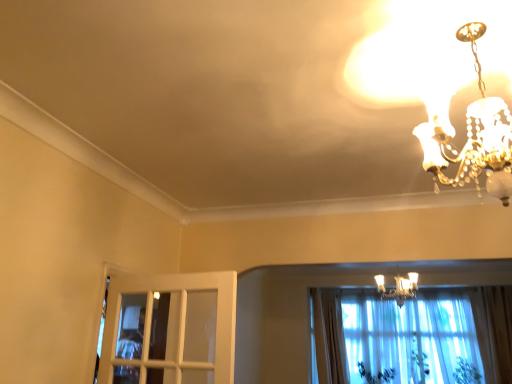
Question: Considering the positions of light beige fabric curtain at lower center and green leafy plant at lower right, arranged as the 3th plant when viewed from the left, in the image, is light beige fabric curtain at lower center wider or thinner than green leafy plant at lower right, arranged as the 3th plant when viewed from the left,?

Choices:
 (A) wide
 (B) thin

Answer: (A)

Question: Based on their sizes in the image, would you say light beige fabric curtain at lower center is bigger or smaller than green leafy plant at lower right, the first plant viewed from the right?

Choices:
 (A) small
 (B) big

Answer: (B)

Question: Estimate the real-world distances between objects in this image. Which object is farther from the green leafy plant at lower right, acting as the 2th plant starting from the right?

Choices:
 (A) light beige fabric curtain at lower center
 (B) green leafy plant at lower right, arranged as the 3th plant when viewed from the left
 (C) gold metallic chandelier at upper right, which ranks as the second lamp in front-to-back order
 (D) green leafy plant at lower right, placed as the third plant when sorted from right to left
 (E) gold metallic chandelier at upper right, which is the second lamp from back to front

Answer: (E)

Question: Considering the real-world distances, which object is closest to the green leafy plant at lower right, acting as the 2th plant starting from the right?

Choices:
 (A) light beige fabric curtain at lower center
 (B) gold metallic chandelier at upper right, marked as the 2th lamp in a top-to-bottom arrangement
 (C) green leafy plant at lower right, placed as the third plant when sorted from right to left
 (D) gold metallic chandelier at upper right, acting as the 2th lamp starting from the bottom
 (E) green leafy plant at lower right, the first plant viewed from the right

Answer: (C)